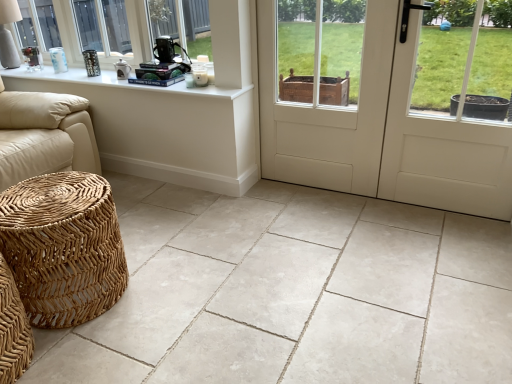
Where is `spots to the right of woven natural basket at lower left`? spots to the right of woven natural basket at lower left is located at coordinates (170, 293).